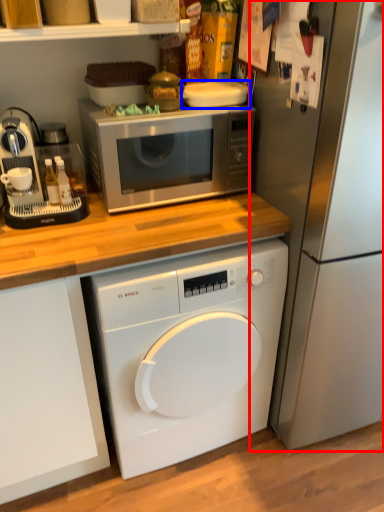
Question: Among these objects, which one is farthest to the camera, refrigerator (highlighted by a red box) or appliance (highlighted by a blue box)?

Choices:
 (A) refrigerator
 (B) appliance

Answer: (B)